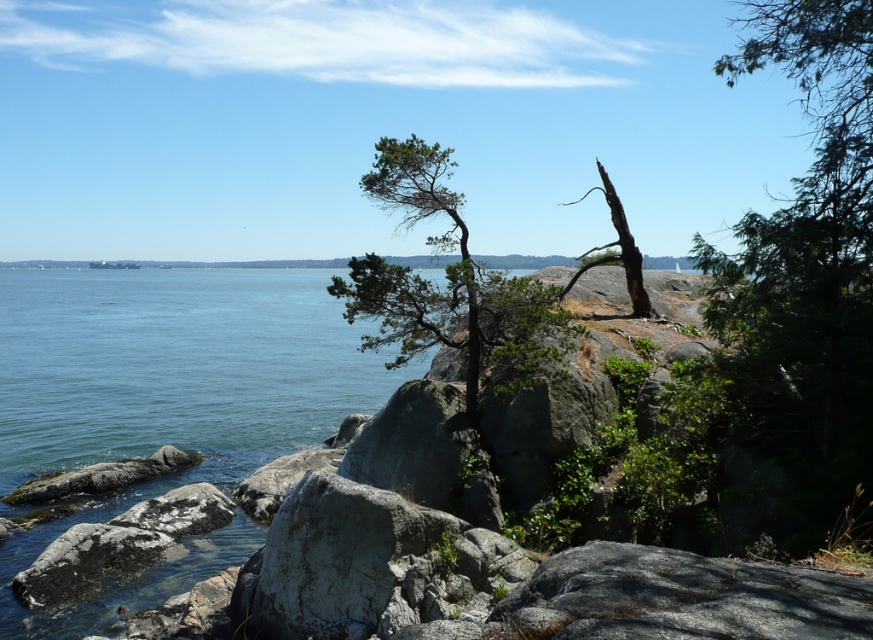
Which is behind, point (418, 282) or point (585, 193)?

The point (585, 193) is behind.

Does point (349, 294) lie in front of point (624, 257)?

Yes, point (349, 294) is in front of point (624, 257).

What are the coordinates of `green textured tree at center` in the screenshot? It's located at (447, 284).

Identify the location of green textured tree at center. The image size is (873, 640). (447, 284).